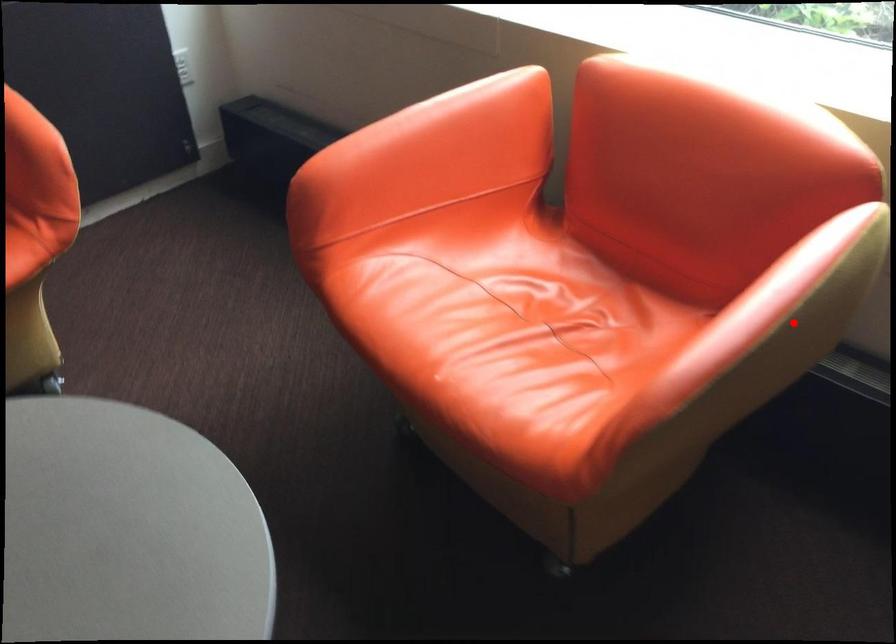
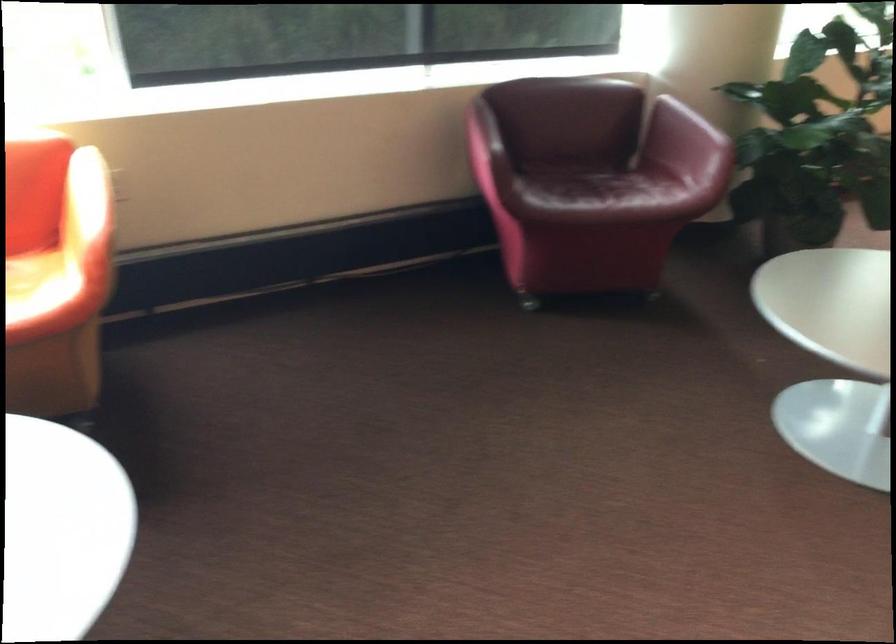
Find the pixel in the second image that matches the highlighted location in the first image.

(113, 189)